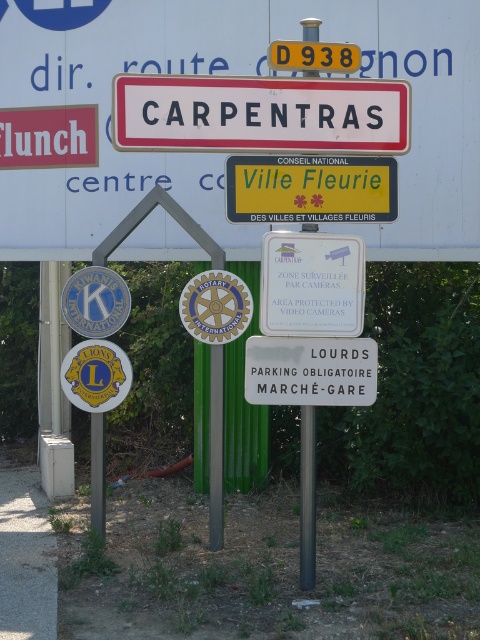
Question: Which is farther from the white plastic signboard at center?

Choices:
 (A) yellowmaterial/texturetraffic sign at center
 (B) yellow plastic road sign at upper center
 (C) white plastic sign at center

Answer: (C)

Question: Among these points, which one is nearest to the camera?

Choices:
 (A) (314, 170)
 (B) (227, 147)

Answer: (B)

Question: Is the position of white plastic sign at center more distant than that of yellow plastic road sign at upper center?

Choices:
 (A) no
 (B) yes

Answer: (B)

Question: Which is farther from the white plastic sign at center?

Choices:
 (A) yellowmaterial/texturetraffic sign at center
 (B) white plastic signboard at center
 (C) yellow plastic road sign at upper center

Answer: (C)

Question: Does white plastic signboard at center have a greater width compared to white plastic sign at center?

Choices:
 (A) no
 (B) yes

Answer: (B)

Question: Is white plastic signboard at center positioned before white plastic sign at center?

Choices:
 (A) no
 (B) yes

Answer: (A)